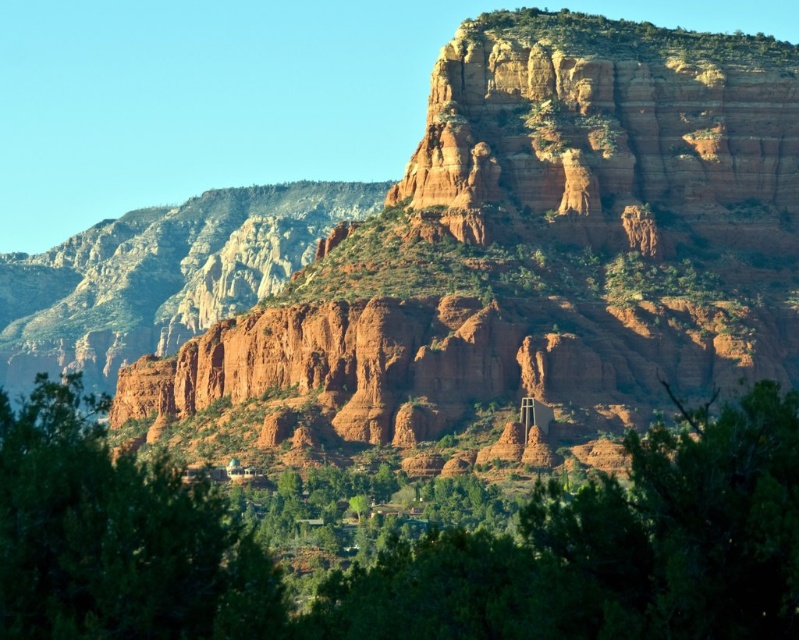
Measure the distance between green leafy tree at center and reddish-brown sandstone cliff at upper center.

green leafy tree at center and reddish-brown sandstone cliff at upper center are 203.20 feet apart from each other.

Can you confirm if green leafy tree at center is taller than reddish-brown sandstone cliff at upper center?

Incorrect, green leafy tree at center's height is not larger of reddish-brown sandstone cliff at upper center's.

Image resolution: width=799 pixels, height=640 pixels. What are the coordinates of `green leafy tree at center` in the screenshot? It's located at (408, 545).

Who is positioned more to the left, rustic rock formation at center or reddish-brown sandstone cliff at upper center?

From the viewer's perspective, rustic rock formation at center appears more on the left side.

Based on the photo, measure the distance between rustic rock formation at center and reddish-brown sandstone cliff at upper center.

rustic rock formation at center and reddish-brown sandstone cliff at upper center are 53.71 feet apart from each other.

Where is `rustic rock formation at center`? The width and height of the screenshot is (799, 640). rustic rock formation at center is located at coordinates (515, 256).

Does rustic rock formation at center appear on the left side of green leafy tree at lower left?

Indeed, rustic rock formation at center is positioned on the left side of green leafy tree at lower left.

Who is lower down, rustic rock formation at center or green leafy tree at lower left?

green leafy tree at lower left is lower down.

The width and height of the screenshot is (799, 640). What do you see at coordinates (515, 256) in the screenshot? I see `rustic rock formation at center` at bounding box center [515, 256].

The width and height of the screenshot is (799, 640). Identify the location of rustic rock formation at center. (515, 256).